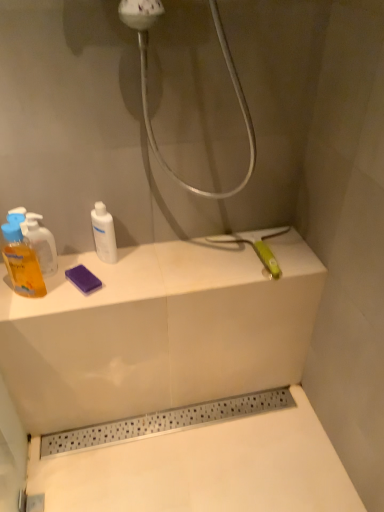
I want to click on vacant area that is in front of white glossy bottle at center, the first mouthwash viewed from the right, so (x=92, y=290).